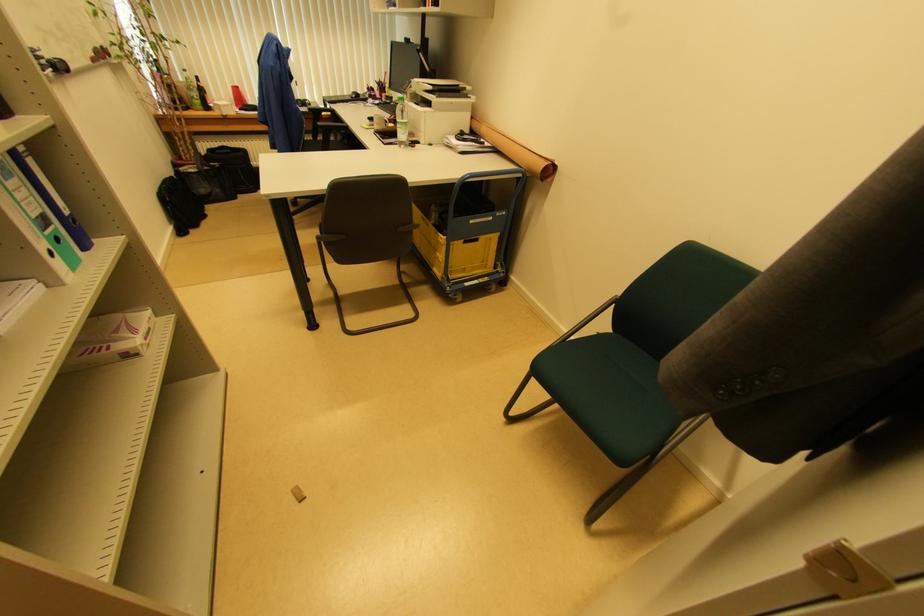
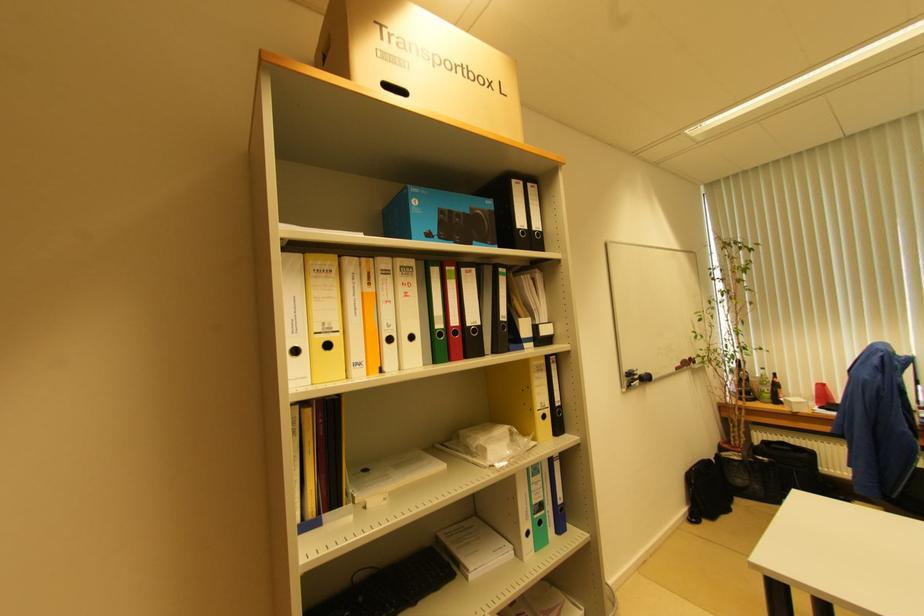
Question: How did the camera likely rotate?

Choices:
 (A) Left
 (B) Right
 (C) Up
 (D) Down

Answer: (A)